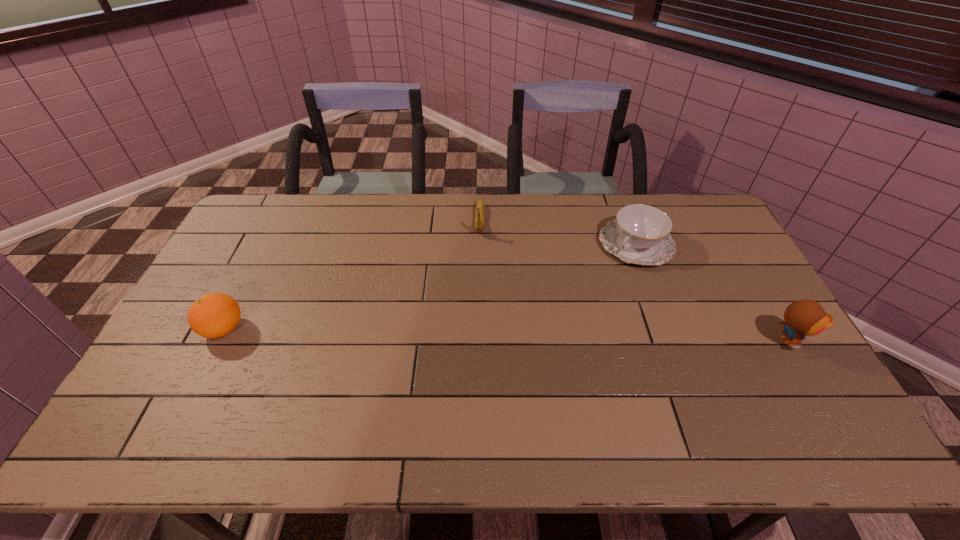
Find the location of `the leftmost object`. the leftmost object is located at coordinates (214, 315).

Where is `the rightmost object`? The height and width of the screenshot is (540, 960). the rightmost object is located at coordinates (807, 317).

I want to click on duck, so click(x=807, y=317).

Identify the location of the second object from left to right. (480, 210).

Where is `chinaware`? The height and width of the screenshot is (540, 960). chinaware is located at coordinates (640, 234).

Where is `vacant space located on the back of the leftmost object`? vacant space located on the back of the leftmost object is located at coordinates click(252, 273).

Find the location of `free space located 0.250m at the stem of the banana`. free space located 0.250m at the stem of the banana is located at coordinates (478, 291).

I want to click on vacant space situated 0.230m at the stem of the banana, so (x=478, y=286).

Where is `vacant space located 0.090m at the stem of the banana`? This screenshot has width=960, height=540. vacant space located 0.090m at the stem of the banana is located at coordinates (479, 255).

Identify the location of vacant space positioned 0.120m on the handle side of the chinaware. (596, 283).